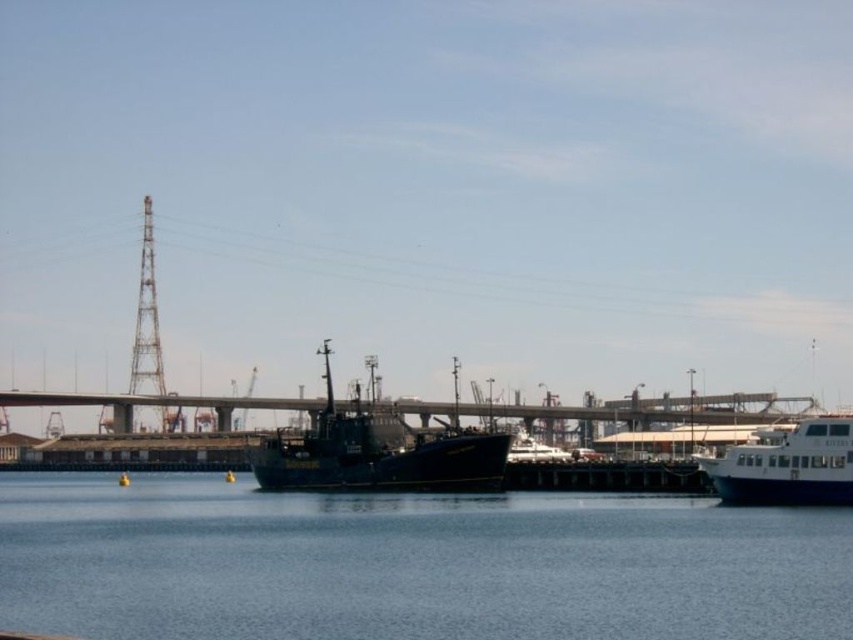
Question: Is blue water at center above matte black ship at center?

Choices:
 (A) no
 (B) yes

Answer: (A)

Question: Which object is the closest to the white glossy ferry at right?

Choices:
 (A) matte black ship at center
 (B) blue water at center

Answer: (A)

Question: Estimate the real-world distances between objects in this image. Which object is closer to the matte black ship at center?

Choices:
 (A) blue water at center
 (B) white glossy ferry at right

Answer: (A)

Question: Does blue water at center appear on the left side of matte black ship at center?

Choices:
 (A) no
 (B) yes

Answer: (A)

Question: Can you confirm if matte black ship at center is smaller than white glossy ferry at right?

Choices:
 (A) yes
 (B) no

Answer: (B)

Question: Estimate the real-world distances between objects in this image. Which object is closer to the white glossy ferry at right?

Choices:
 (A) matte black ship at center
 (B) blue water at center

Answer: (A)